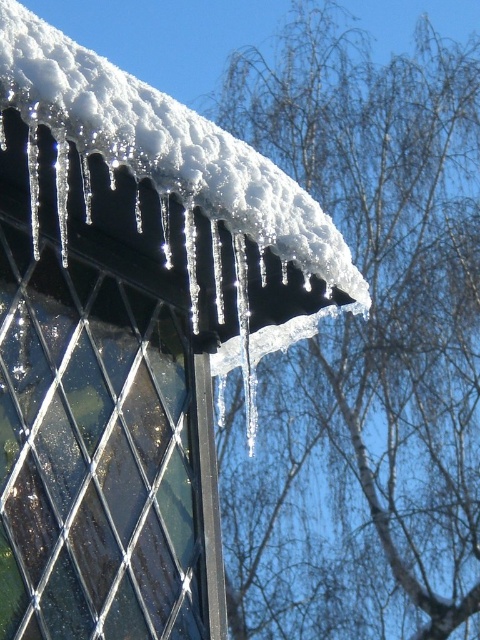
You are an architect designing a new roof structure. You need to ensure that the white snow at upper center and the clear ice icicles at upper left do not cause structural issues. Which of these two elements is more likely to contribute to potential roof damage due to its height?

The white snow at upper center is much taller than the clear ice icicles at upper left, so it is more likely to contribute to potential roof damage due to its greater height and weight.

You are standing on the snowy roof and looking towards the edge. Which object is positioned to the right of the other between the white snow at upper center and the clear ice icicles at upper left?

The white snow at upper center is positioned to the right of the clear ice icicles at upper left.